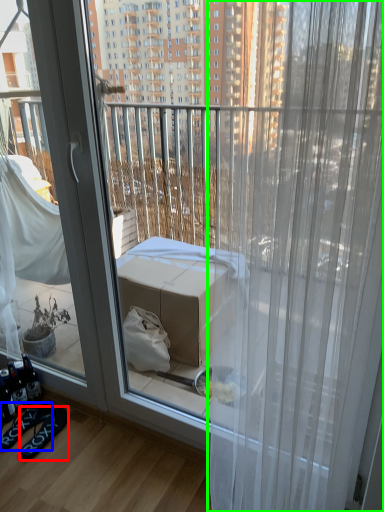
Question: Which object is the farthest from footwear (highlighted by a red box)? Choose among these: footwear (highlighted by a blue box) or curtain (highlighted by a green box).

Choices:
 (A) footwear
 (B) curtain

Answer: (B)